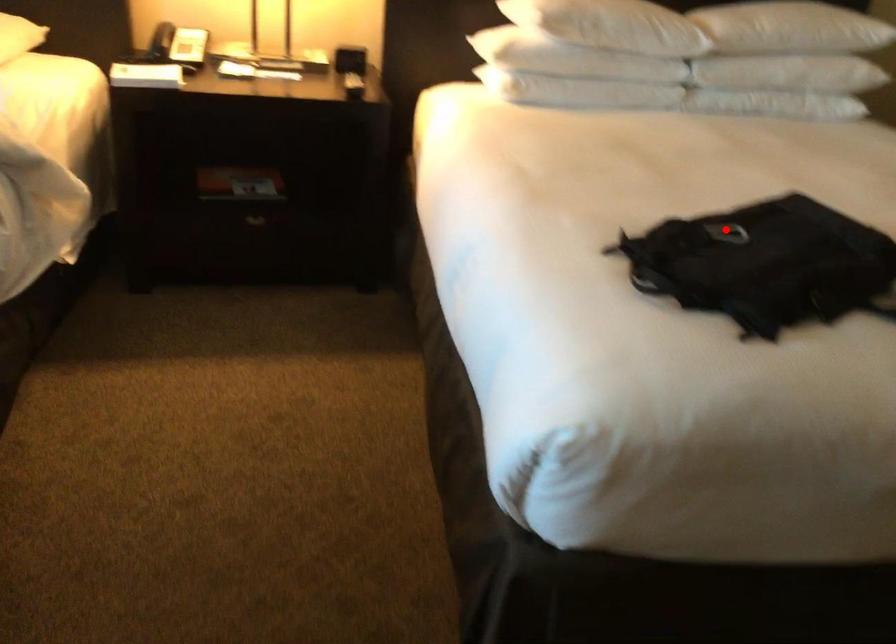
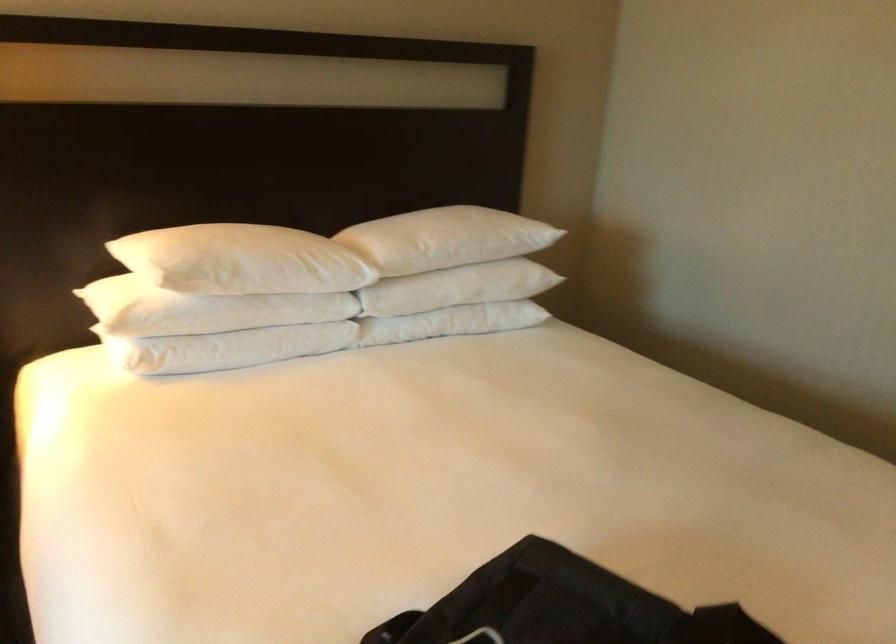
Question: I am providing you with two images of the same scene from different viewpoints. A red point is shown in image1. For the corresponding object point in image2, is it positioned nearer or farther from the camera?

Choices:
 (A) Nearer
 (B) Farther

Answer: (A)